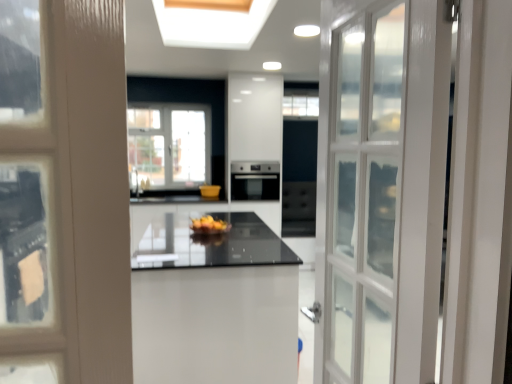
Question: Considering the relative positions of yellow matte bowl at center and white glossy table at center in the image provided, is yellow matte bowl at center to the right of white glossy table at center from the viewer's perspective?

Choices:
 (A) no
 (B) yes

Answer: (B)

Question: Are yellow matte bowl at center and white glossy table at center far apart?

Choices:
 (A) no
 (B) yes

Answer: (A)

Question: From a real-world perspective, is yellow matte bowl at center physically above white glossy table at center?

Choices:
 (A) yes
 (B) no

Answer: (A)

Question: Is yellow matte bowl at center oriented towards white glossy table at center?

Choices:
 (A) yes
 (B) no

Answer: (B)

Question: From the image's perspective, is yellow matte bowl at center over white glossy table at center?

Choices:
 (A) no
 (B) yes

Answer: (B)

Question: Is yellow matte bowl at center facing away from white glossy table at center?

Choices:
 (A) no
 (B) yes

Answer: (A)

Question: From a real-world perspective, is white glossy table at center located higher than satin black oven at center?

Choices:
 (A) no
 (B) yes

Answer: (A)

Question: Is the position of white glossy table at center less distant than that of satin black oven at center?

Choices:
 (A) yes
 (B) no

Answer: (A)

Question: Is white glossy table at center far from satin black oven at center?

Choices:
 (A) no
 (B) yes

Answer: (B)

Question: Is white glossy table at center directly adjacent to satin black oven at center?

Choices:
 (A) yes
 (B) no

Answer: (B)

Question: Is white glossy table at center smaller than satin black oven at center?

Choices:
 (A) no
 (B) yes

Answer: (A)

Question: From the image's perspective, is white glossy table at center below satin black oven at center?

Choices:
 (A) no
 (B) yes

Answer: (B)

Question: Does satin black oven at center contain yellow matte bowl at center?

Choices:
 (A) yes
 (B) no

Answer: (B)